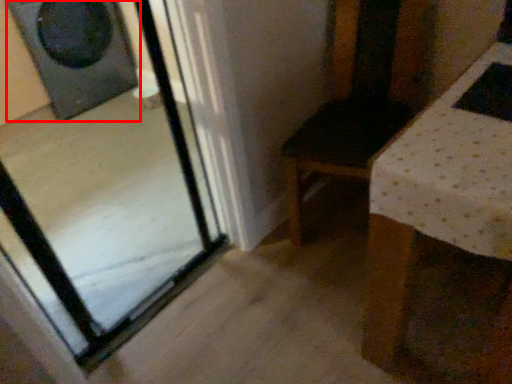
Question: From the image's perspective, where is speaker (annotated by the red box) located relative to glass door?

Choices:
 (A) above
 (B) below

Answer: (A)